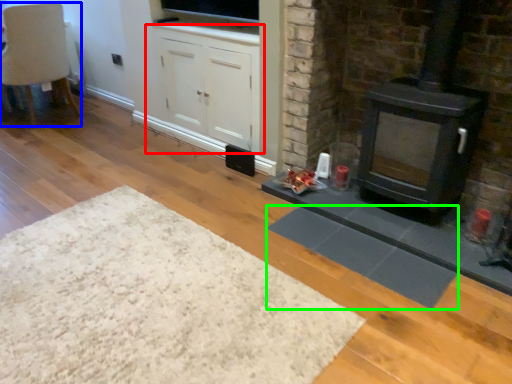
Question: Considering the real-world distances, which object is closest to cabinetry (highlighted by a red box)? chair (highlighted by a blue box) or mat (highlighted by a green box).

Choices:
 (A) chair
 (B) mat

Answer: (B)